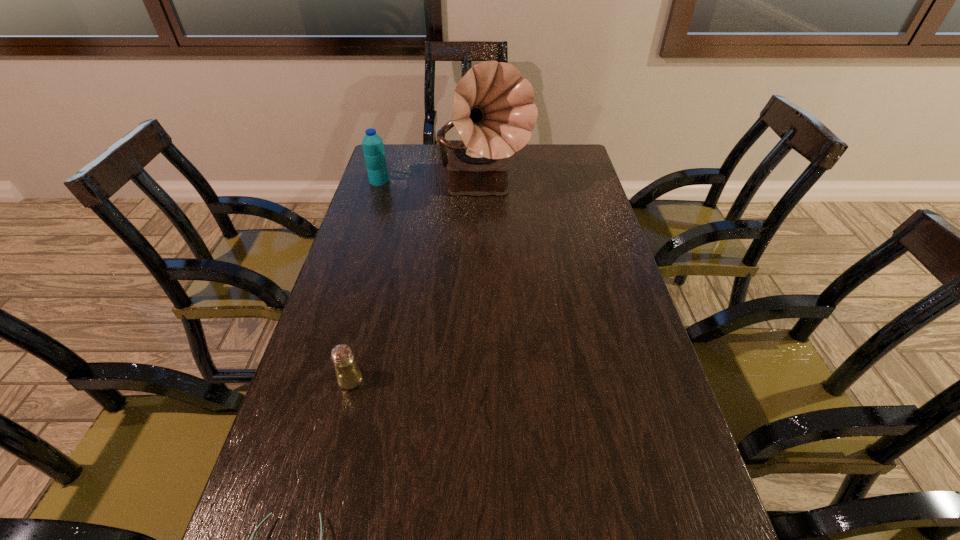
Image resolution: width=960 pixels, height=540 pixels. Find the location of `the tallest object`. the tallest object is located at coordinates (494, 113).

The height and width of the screenshot is (540, 960). Identify the location of record player. (494, 113).

Locate an element on the screen. This screenshot has width=960, height=540. the third shortest object is located at coordinates (373, 148).

Identify the location of the third tallest object. Image resolution: width=960 pixels, height=540 pixels. (348, 375).

You are a GUI agent. You are given a task and a screenshot of the screen. Output one action in this format:
    pyautogui.click(x=<x>, y=<y>)
    Task: Click on the second nearest object
    
    Given the screenshot: What is the action you would take?
    pos(348,375)

Find the location of a particular element. The width and height of the screenshot is (960, 540). vacant area located from the horn of the record player is located at coordinates (485, 284).

Locate an element on the screen. The image size is (960, 540). free spot located 0.100m on the right of the water bottle is located at coordinates (416, 181).

Identify the location of vacant area located 0.150m on the back of the second shortest object. (366, 321).

Where is `object at the far edge`? The image size is (960, 540). object at the far edge is located at coordinates (494, 113).

Where is `water bottle present at the left edge`? water bottle present at the left edge is located at coordinates (373, 148).